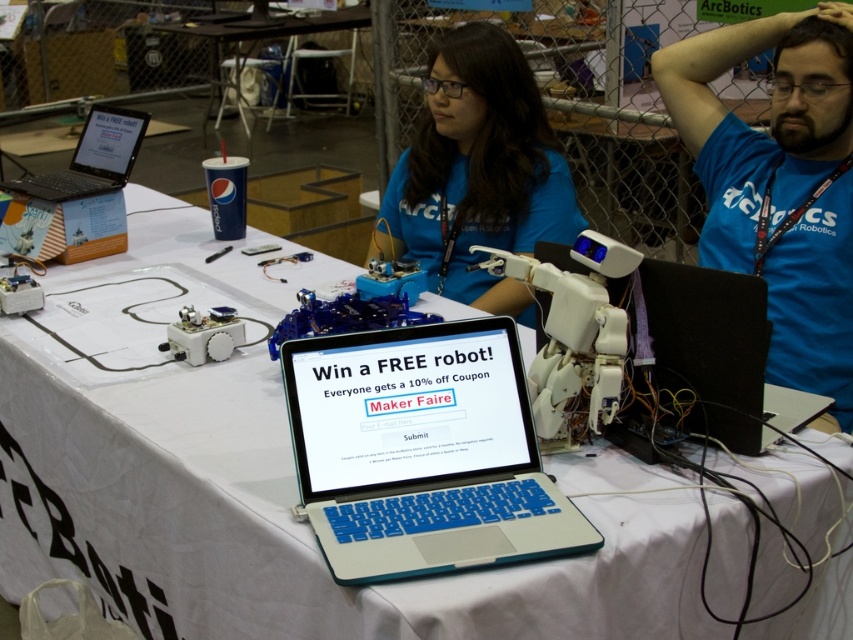
You are a participant at the Maker Faire and you see the blue matte shirt at center and the black matte laptop at right on the table. Which object takes up more space on the table?

The blue matte shirt at center has a larger size compared to the black matte laptop at right, so it takes up more space on the table.

You are a participant at the Maker Faire and you need to place a new item on the table. The item requires a space that is taller than both the blue matte shirt at center and the black matte laptop at right. Can you determine if there is enough vertical space available on the table for this item?

The blue matte shirt at center is taller than the black matte laptop at right. Since the required vertical space must be greater than both, the tallest object on the table is the blue matte shirt at center. Therefore, the vertical space needed must exceed the height of the blue matte shirt at center to accommodate the new item.

You are setting up for a presentation and need to place both the blue plastic laptop at center and the black matte laptop at right on a shelf. The shelf has limited vertical space, only allowing items up to 5 inches tall. Given their heights, can both laptops fit on the shelf without exceeding the height limit?

The blue plastic laptop at center is taller than the black matte laptop at right. Since the shelf allows items up to 5 inches tall, we need to know the exact height of the blue plastic laptop at center. However, the description only states it is taller than the black one. Without specific measurements, we cannot confirm if it exceeds 5 inches. Therefore, it is uncertain if both can fit without more information.